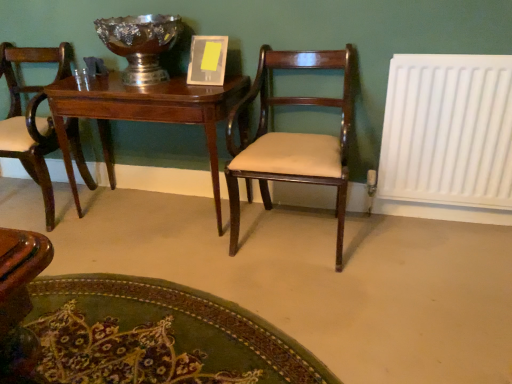
Question: Is matte wood chair at left, marked as the 2th chair in a right-to-left arrangement, surrounded by shiny silver bowl at upper center?

Choices:
 (A) yes
 (B) no

Answer: (B)

Question: From the image's perspective, does shiny silver bowl at upper center appear lower than matte wood chair at left, the first chair positioned from the left?

Choices:
 (A) yes
 (B) no

Answer: (B)

Question: Can you confirm if shiny silver bowl at upper center is smaller than matte wood chair at left, marked as the 2th chair in a right-to-left arrangement?

Choices:
 (A) yes
 (B) no

Answer: (A)

Question: Can you see shiny silver bowl at upper center touching matte wood chair at left, marked as the 2th chair in a right-to-left arrangement?

Choices:
 (A) yes
 (B) no

Answer: (B)

Question: Is shiny silver bowl at upper center oriented towards matte wood chair at left, the first chair positioned from the left?

Choices:
 (A) no
 (B) yes

Answer: (A)

Question: Does shiny silver bowl at upper center have a lesser height compared to matte wood chair at left, marked as the 2th chair in a right-to-left arrangement?

Choices:
 (A) yes
 (B) no

Answer: (A)

Question: From the image's perspective, does mahogany wood table at center appear higher than white plastic radiator at right?

Choices:
 (A) yes
 (B) no

Answer: (B)

Question: Is mahogany wood table at center taller than white plastic radiator at right?

Choices:
 (A) yes
 (B) no

Answer: (B)

Question: Is mahogany wood table at center in contact with white plastic radiator at right?

Choices:
 (A) yes
 (B) no

Answer: (B)

Question: Can you confirm if mahogany wood table at center is bigger than white plastic radiator at right?

Choices:
 (A) yes
 (B) no

Answer: (A)

Question: Is mahogany wood table at center closer to camera compared to white plastic radiator at right?

Choices:
 (A) yes
 (B) no

Answer: (B)

Question: Is white plastic radiator at right a part of mahogany wood table at center?

Choices:
 (A) yes
 (B) no

Answer: (B)

Question: From the image's perspective, is mahogany wood chair at center, acting as the first chair starting from the right, beneath mahogany wood table at center?

Choices:
 (A) no
 (B) yes

Answer: (B)